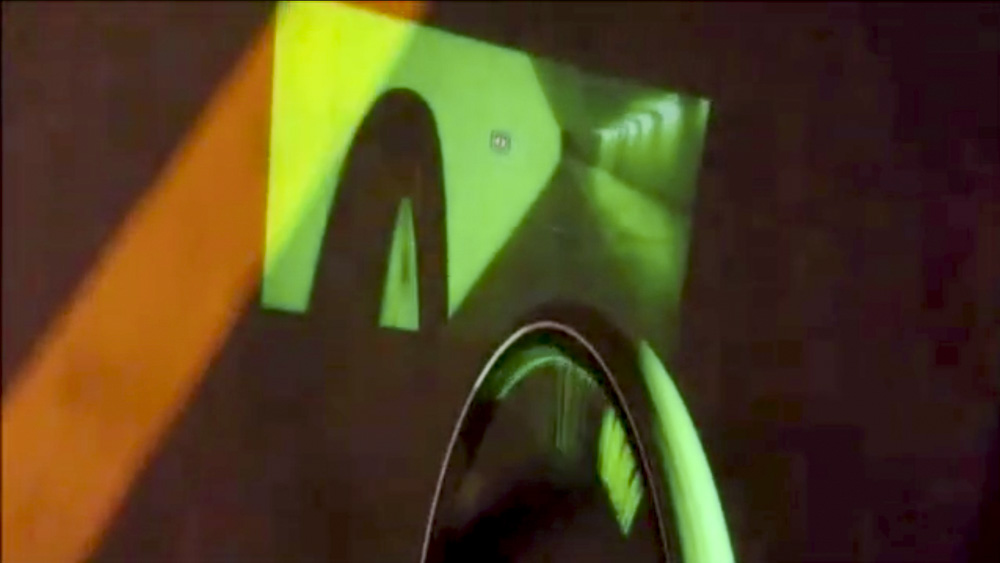
The height and width of the screenshot is (563, 1000). I want to click on green ceiling, so click(595, 98), click(577, 146).